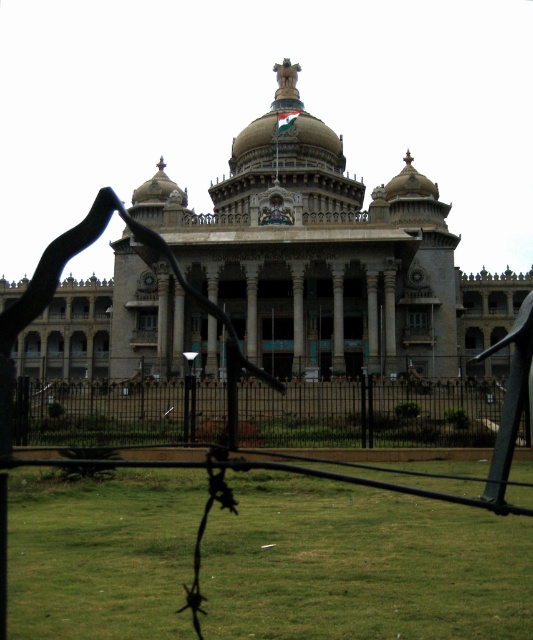
Is green grass at lower center shorter than black metal fence at center?

Indeed, green grass at lower center has a lesser height compared to black metal fence at center.

Who is more forward, (327, 576) or (29, 387)?

Point (327, 576)

Is point (295, 490) closer to camera compared to point (448, 388)?

Yes, point (295, 490) is in front of point (448, 388).

Find the location of a particular element. green grass at lower center is located at coordinates [360, 564].

How far apart are beige stone palace at center and black metal fence at center?

A distance of 21.66 meters exists between beige stone palace at center and black metal fence at center.

Where is `beige stone palace at center`? Image resolution: width=533 pixels, height=640 pixels. beige stone palace at center is located at coordinates (332, 257).

Which is behind, point (209, 332) or point (53, 429)?

Point (209, 332)

You are a GUI agent. You are given a task and a screenshot of the screen. Output one action in this format:
    pyautogui.click(x=<x>, y=<y>)
    Task: Click on the beige stone palace at center
    
    Given the screenshot: What is the action you would take?
    pyautogui.click(x=332, y=257)

Can you confirm if green grass at lower center is wider than beige stone palace at center?

In fact, green grass at lower center might be narrower than beige stone palace at center.

Who is taller, green grass at lower center or beige stone palace at center?

beige stone palace at center is taller.

Who is more forward, (91, 596) or (286, 84)?

Positioned in front is point (91, 596).

Identify the location of green grass at lower center. This screenshot has height=640, width=533. (360, 564).